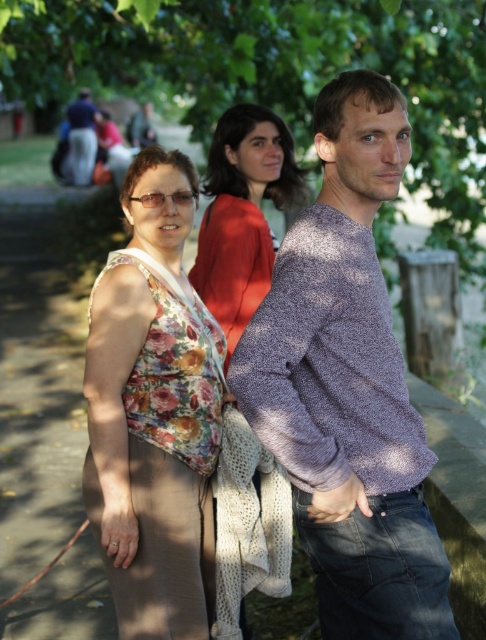
You are a photographer trying to capture a clear shot of both the floral fabric blouse at center and the dark blue sweater at center. Based on their positions, which one is closer to the camera?

The floral fabric blouse at center is closer to the camera because it is in front of the dark blue sweater at center.

You are a photographer trying to capture a photo of the purple textured sweater at center and the green leafy tree at center. Which object should you focus on first if you want to ensure both are in focus, considering their sizes in the frame?

The green leafy tree at center should be focused on first because it is taller than the purple textured sweater at center, so adjusting focus starting from the taller object ensures both are in focus.